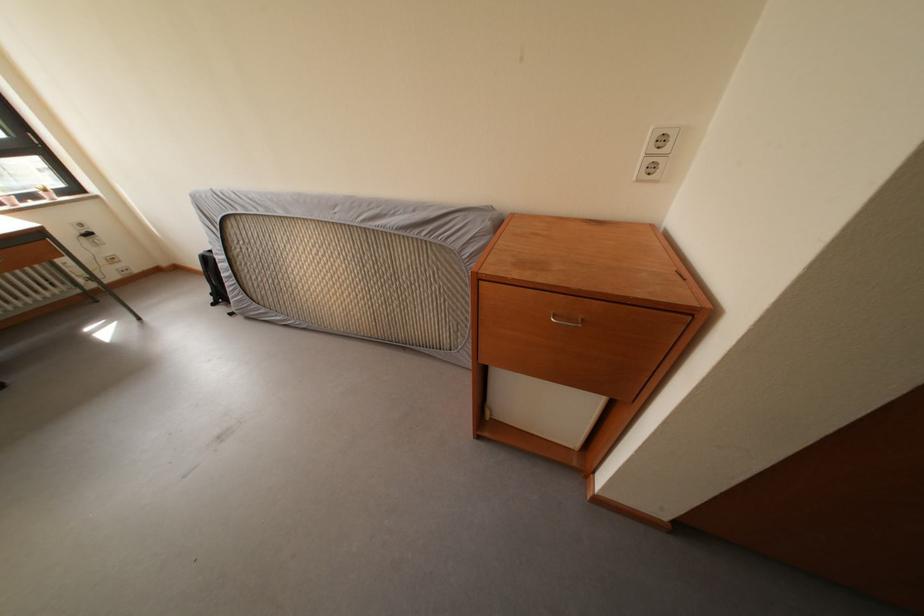
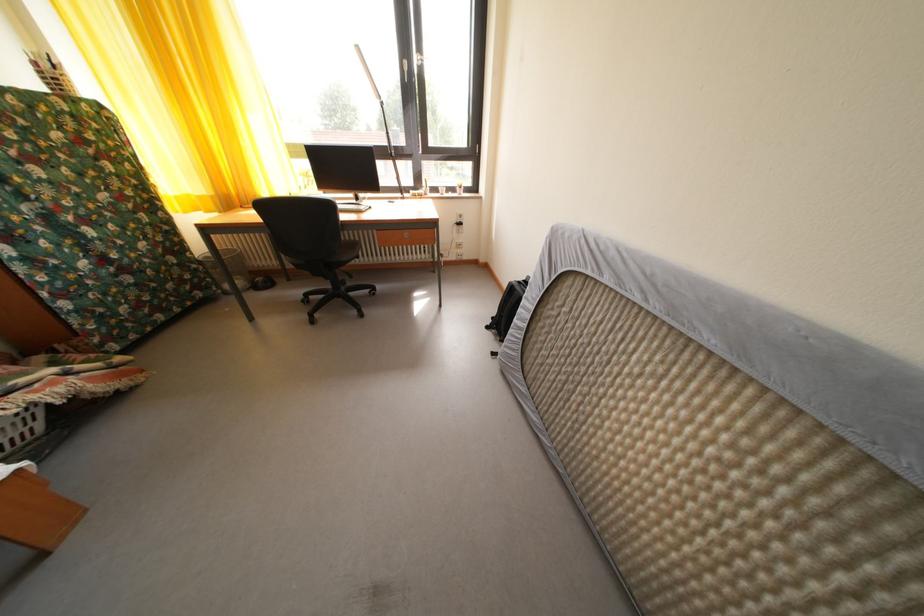
In the second image, find the point that corresponds to the point at 224,310 in the first image.

(496, 334)